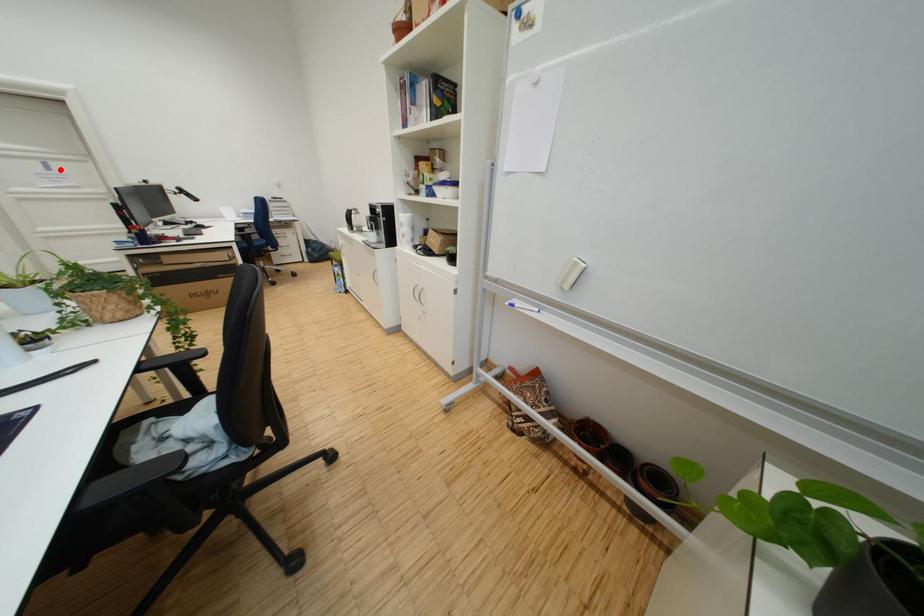
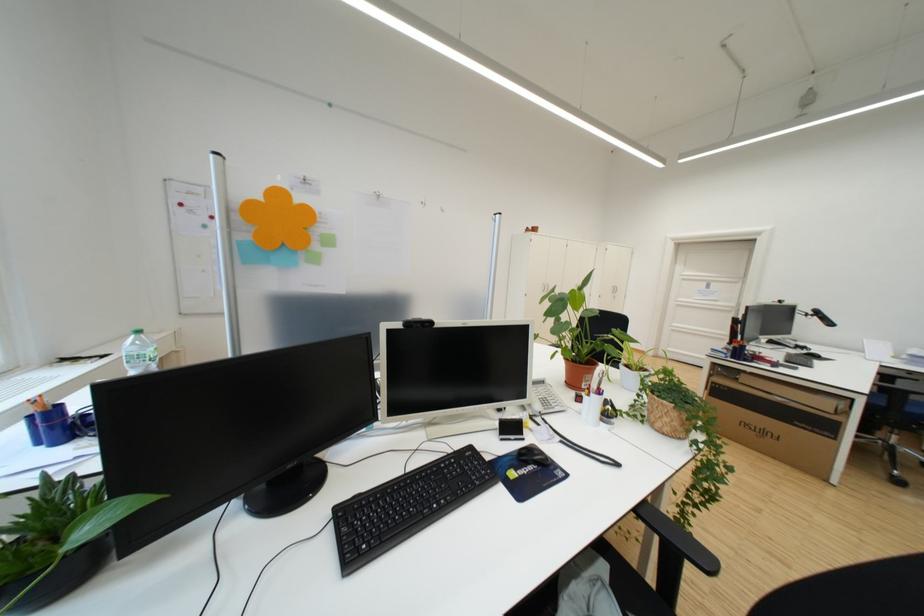
In the second image, find the point that corresponds to the highlighted location in the first image.

(720, 288)